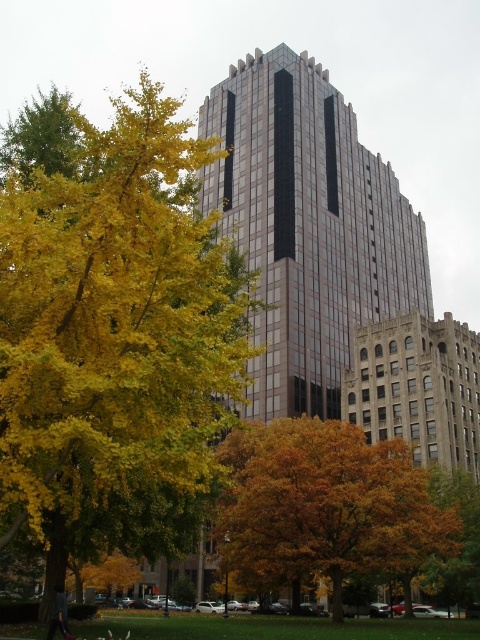
Is glassy brown building at center in front of orange leafy tree at center?

No, glassy brown building at center is behind orange leafy tree at center.

Which of these two, glassy brown building at center or orange leafy tree at center, stands taller?

glassy brown building at center

Is point (319, 416) closer to viewer compared to point (250, 584)?

No, it is not.

Image resolution: width=480 pixels, height=640 pixels. Find the location of `glassy brown building at center`. glassy brown building at center is located at coordinates (308, 227).

Is yellow-green leaves at left taller than glassy brown building at center?

Yes.

Is yellow-green leaves at left further to the viewer compared to glassy brown building at center?

No, it is in front of glassy brown building at center.

Describe the element at coordinates (117, 339) in the screenshot. I see `yellow-green leaves at left` at that location.

At what (x,y) coordinates should I click in order to perform the action: click on yellow-green leaves at left. Please return your answer as a coordinate pair (x, y). Looking at the image, I should click on (117, 339).

Which is below, orange leafy tree at center or brown stone building at center?

orange leafy tree at center is lower down.

Does orange leafy tree at center have a greater height compared to brown stone building at center?

Correct, orange leafy tree at center is much taller as brown stone building at center.

The width and height of the screenshot is (480, 640). Describe the element at coordinates (324, 506) in the screenshot. I see `orange leafy tree at center` at that location.

Where is `orange leafy tree at center`? orange leafy tree at center is located at coordinates (324, 506).